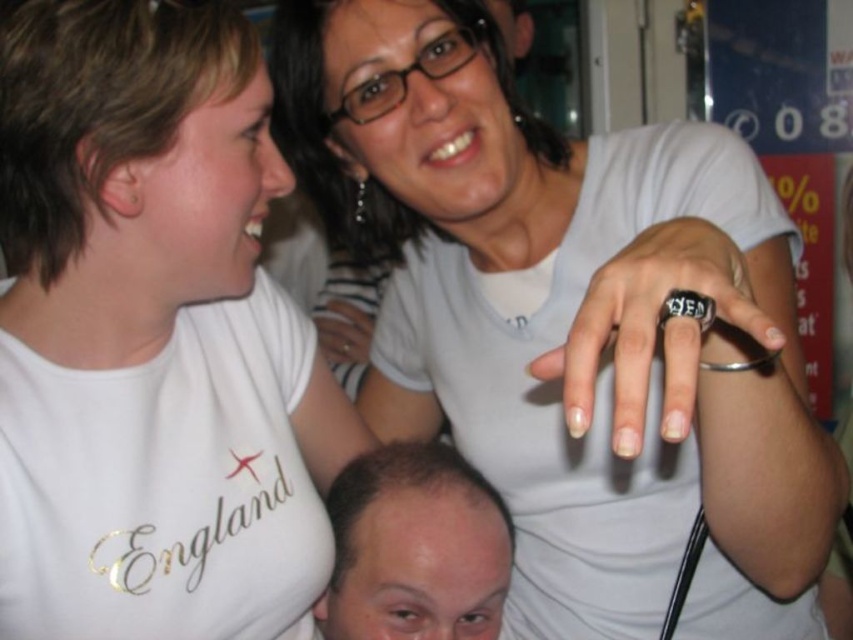
Which of these two, white matte ring at upper center or white matte t-shirt at upper left, stands taller?

white matte ring at upper center is taller.

The image size is (853, 640). I want to click on white matte ring at upper center, so click(x=556, y=320).

Which is more to the left, white matte t-shirt at upper left or smooth bald head at lower center?

Positioned to the left is white matte t-shirt at upper left.

Does white matte t-shirt at upper left have a larger size compared to smooth bald head at lower center?

Indeed, white matte t-shirt at upper left has a larger size compared to smooth bald head at lower center.

Who is more distant from viewer, [258,616] or [469,497]?

Positioned behind is point [469,497].

Locate an element on the screen. white matte t-shirt at upper left is located at coordinates (151, 337).

Does point (610, 148) come farther from viewer compared to point (439, 625)?

Yes, it is behind point (439, 625).

What are the coordinates of `white matte ring at upper center` in the screenshot? It's located at (556, 320).